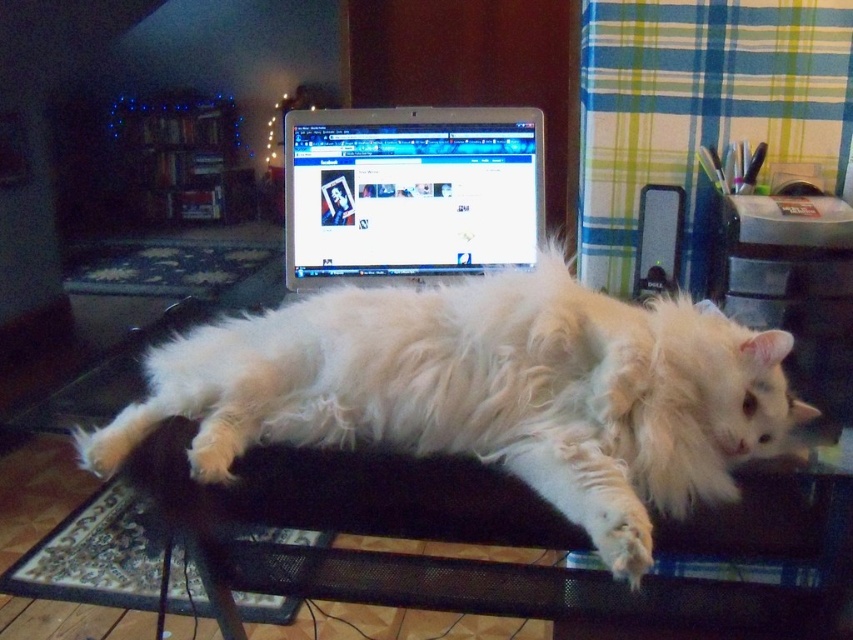
Can you confirm if black mesh table at center is positioned below satin glossy monitor at center?

Indeed, black mesh table at center is positioned under satin glossy monitor at center.

Between point (752, 616) and point (524, 120), which one is positioned in front?

Positioned in front is point (752, 616).

The image size is (853, 640). Find the location of `black mesh table at center`. black mesh table at center is located at coordinates (419, 538).

From the picture: Who is more forward, (410, 419) or (503, 576)?

Point (410, 419)

Find the location of a particular element. white fluffy cat at center is located at coordinates (486, 392).

Where is `white fluffy cat at center`? white fluffy cat at center is located at coordinates (486, 392).

Which is in front, point (579, 486) or point (454, 260)?

Positioned in front is point (579, 486).

Is white fluffy cat at center above satin glossy monitor at center?

Actually, white fluffy cat at center is below satin glossy monitor at center.

What do you see at coordinates (486, 392) in the screenshot? I see `white fluffy cat at center` at bounding box center [486, 392].

Find the location of a particular element. The image size is (853, 640). white fluffy cat at center is located at coordinates (486, 392).